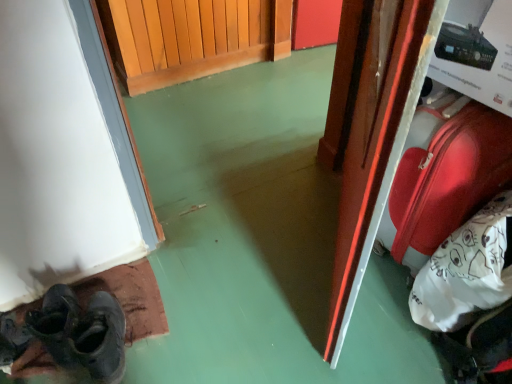
Question: Are shiny red suitcase at right and dark gray leather shoes at lower left beside each other?

Choices:
 (A) yes
 (B) no

Answer: (B)

Question: From a real-world perspective, does shiny red suitcase at right sit lower than dark gray leather shoes at lower left?

Choices:
 (A) yes
 (B) no

Answer: (B)

Question: Does shiny red suitcase at right have a lesser height compared to dark gray leather shoes at lower left?

Choices:
 (A) no
 (B) yes

Answer: (A)

Question: Can you confirm if shiny red suitcase at right is positioned to the left of dark gray leather shoes at lower left?

Choices:
 (A) yes
 (B) no

Answer: (B)

Question: Is dark gray leather shoes at lower left completely or partially inside shiny red suitcase at right?

Choices:
 (A) yes
 (B) no

Answer: (B)

Question: Does shiny red suitcase at right have a smaller size compared to dark gray leather shoes at lower left?

Choices:
 (A) yes
 (B) no

Answer: (B)

Question: Does dark gray leather shoes at lower left have a greater height compared to dark gray leather shoe at lower left?

Choices:
 (A) yes
 (B) no

Answer: (A)

Question: Is dark gray leather shoes at lower left further to camera compared to dark gray leather shoe at lower left?

Choices:
 (A) yes
 (B) no

Answer: (A)

Question: Is dark gray leather shoes at lower left outside dark gray leather shoe at lower left?

Choices:
 (A) no
 (B) yes

Answer: (B)

Question: Is dark gray leather shoes at lower left touching dark gray leather shoe at lower left?

Choices:
 (A) no
 (B) yes

Answer: (B)

Question: Is dark gray leather shoes at lower left shorter than dark gray leather shoe at lower left?

Choices:
 (A) yes
 (B) no

Answer: (B)

Question: From a real-world perspective, is dark gray leather shoes at lower left located beneath dark gray leather shoe at lower left?

Choices:
 (A) yes
 (B) no

Answer: (B)

Question: Does glossy wood door at right come behind dark gray leather shoe at lower left?

Choices:
 (A) yes
 (B) no

Answer: (B)